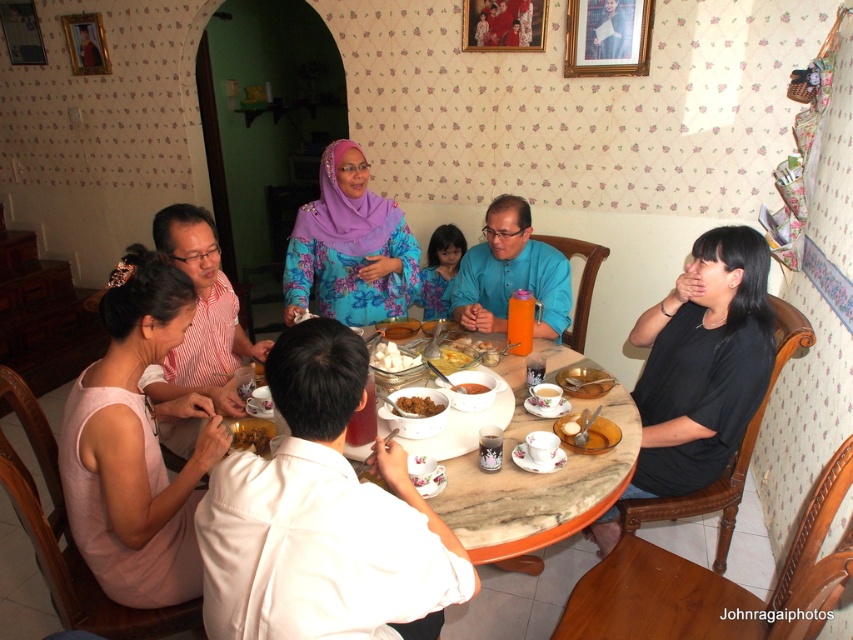
You are a guest at this family gathering and want to reach for the white glossy rice at center without touching the blue satin blouse at center. Is this possible?

The blue satin blouse at center is above the white glossy rice at center, so you can reach the white glossy rice at center without touching the blue satin blouse at center by going underneath.

You are a guest at the table and want to choose between the brown crumbly bread at center and the brown matte food at center. Which one is thinner?

The brown crumbly bread at center is thinner than the brown matte food at center.

You are a guest at this family gathering and want to reach for the brown matte food at center without disturbing the person wearing the floral fabric hijab at center. Can you do this easily?

The brown matte food at center is behind the floral fabric hijab at center, so you can easily reach for it without disturbing the person wearing the floral fabric hijab at center.